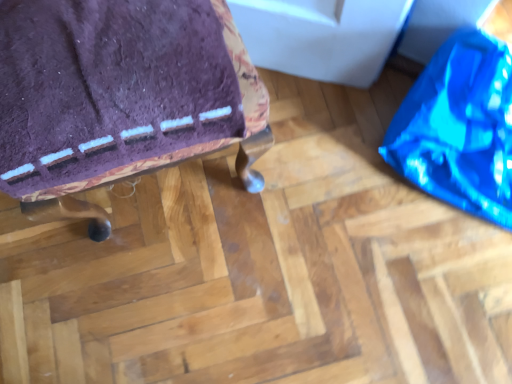
The height and width of the screenshot is (384, 512). I want to click on vacant space to the right of purple fabric cushion at upper left, so coord(321,171).